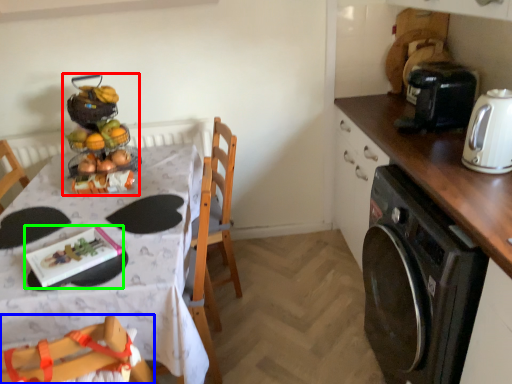
Question: Estimate the real-world distances between objects in this image. Which object is closer to food (highlighted by a red box), chair (highlighted by a blue box) or tableware (highlighted by a green box)?

Choices:
 (A) chair
 (B) tableware

Answer: (B)